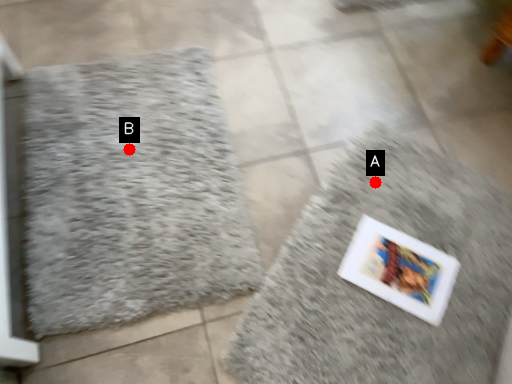
Question: Two points are circled on the image, labeled by A and B beside each circle. Which point is further to the camera?

Choices:
 (A) A is further
 (B) B is further

Answer: (B)